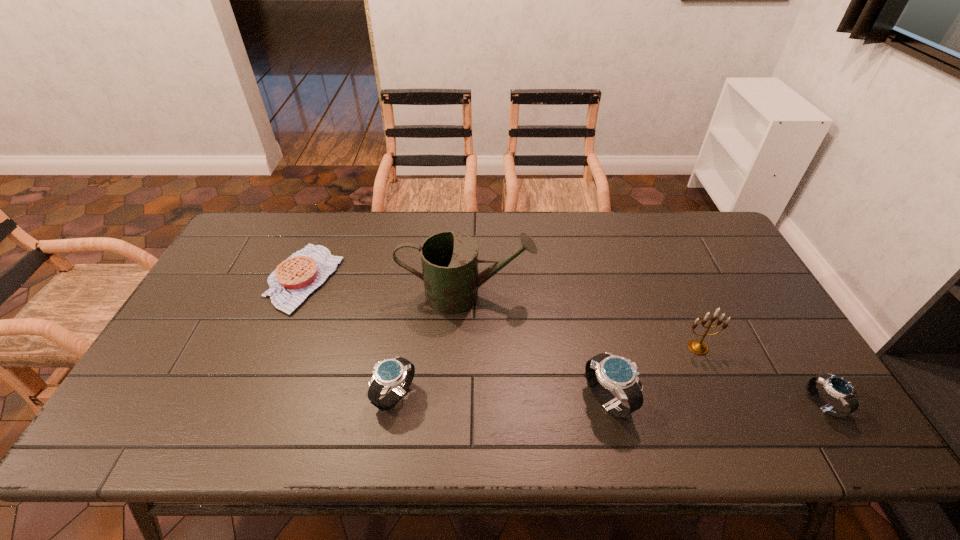
You are a GUI agent. You are given a task and a screenshot of the screen. Output one action in this format:
    pyautogui.click(x=<x>, y=<y>)
    Task: Click on the vacant space that's between the third shortest object and the fifth object from left to right
    The width and height of the screenshot is (960, 540).
    Given the screenshot: What is the action you would take?
    pyautogui.click(x=546, y=372)

At what (x,y) coordinates should I click in order to perform the action: click on free point between the second tallest object and the fourth tallest object. Please return your answer as a coordinate pair (x, y). Looking at the image, I should click on (546, 372).

Identify which object is the fourth closest to the watering can. Please provide its 2D coordinates. Your answer should be formatted as a tuple, i.e. [(x, y)], where the tuple contains the x and y coordinates of a point satisfying the conditions above.

[(698, 347)]

Where is `the fifth closest object to the leftmost watch`? the fifth closest object to the leftmost watch is located at coordinates (838, 387).

This screenshot has height=540, width=960. Identify the location of watch that is the closest to the second shortest watch. click(x=606, y=371).

Identify the location of watch that can be found as the third closest to the watering can. (838, 387).

Where is `free space in the image that satisfies the following two spatial constraints: 1. with the spout on the watering can; 2. on the back side of the shortest watch`? The width and height of the screenshot is (960, 540). free space in the image that satisfies the following two spatial constraints: 1. with the spout on the watering can; 2. on the back side of the shortest watch is located at coordinates (463, 405).

Find the location of a particular element. Image resolution: width=960 pixels, height=540 pixels. free point that satisfies the following two spatial constraints: 1. on the front side of the leftmost watch; 2. on the left side of the rightmost watch is located at coordinates (394, 405).

I want to click on vacant space that satisfies the following two spatial constraints: 1. on the back side of the second object from right to left; 2. with the spout on the watering can, so click(x=675, y=294).